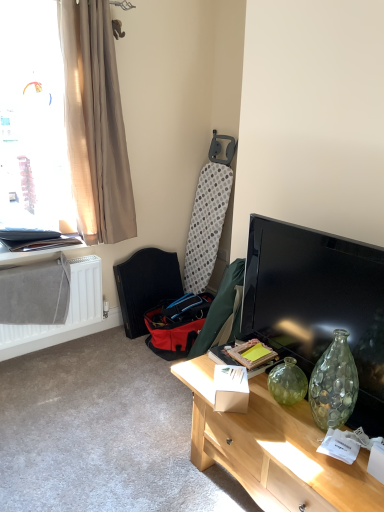
Question: From a real-world perspective, does translucent beige curtain at upper left sit lower than black glossy tv at right?

Choices:
 (A) yes
 (B) no

Answer: (B)

Question: From the image's perspective, is translucent beige curtain at upper left below black glossy tv at right?

Choices:
 (A) no
 (B) yes

Answer: (A)

Question: Considering the relative sizes of translucent beige curtain at upper left and black glossy tv at right in the image provided, is translucent beige curtain at upper left shorter than black glossy tv at right?

Choices:
 (A) no
 (B) yes

Answer: (A)

Question: Is translucent beige curtain at upper left facing away from black glossy tv at right?

Choices:
 (A) no
 (B) yes

Answer: (A)

Question: Is translucent beige curtain at upper left located outside black glossy tv at right?

Choices:
 (A) no
 (B) yes

Answer: (B)

Question: Can you confirm if translucent beige curtain at upper left is positioned to the left of black glossy tv at right?

Choices:
 (A) no
 (B) yes

Answer: (B)

Question: From a real-world perspective, does black glossy tv at right stand above beige fabric curtain at left?

Choices:
 (A) no
 (B) yes

Answer: (A)

Question: From a real-world perspective, is black glossy tv at right below beige fabric curtain at left?

Choices:
 (A) yes
 (B) no

Answer: (A)

Question: Does black glossy tv at right have a larger size compared to beige fabric curtain at left?

Choices:
 (A) yes
 (B) no

Answer: (B)

Question: Is black glossy tv at right wider than beige fabric curtain at left?

Choices:
 (A) no
 (B) yes

Answer: (A)

Question: Can you confirm if black glossy tv at right is positioned to the right of beige fabric curtain at left?

Choices:
 (A) no
 (B) yes

Answer: (B)

Question: Is black glossy tv at right facing away from beige fabric curtain at left?

Choices:
 (A) no
 (B) yes

Answer: (A)

Question: From the image's perspective, is red fabric swivel chair at lower left located above white matte radiator at lower left?

Choices:
 (A) no
 (B) yes

Answer: (B)